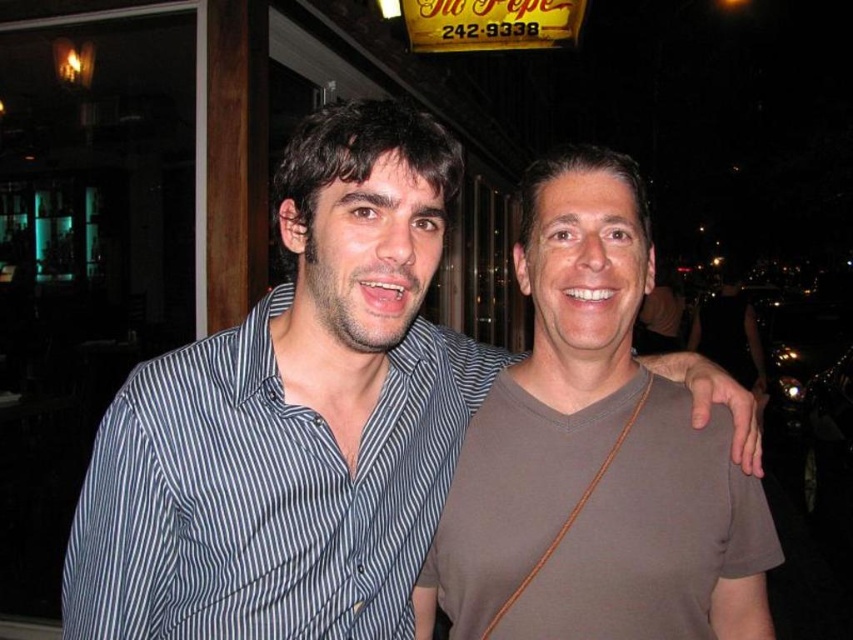
You are a photographer trying to capture the two friends standing outside the restaurant. You want to ensure that the striped cotton shirt at center is visible above the brown matte shirt at center in your photo. Is this possible based on their current positions?

Yes, the striped cotton shirt at center is already located above the brown matte shirt at center, so capturing this arrangement in the photo is feasible.

You are standing at the point marked with coordinates [384,189]. You want to move to the entrance of the building behind the illuminated sign. The entrance is 3 feet away from your current position. Can you reach the entrance without moving more than 3 feet?

The point marked with coordinates [384,189] and the viewer are 37.70 inches apart. Since 37.70 inches is approximately 3.14 feet, which is slightly more than 3 feet, you cannot reach the entrance without moving more than 3 feet.

You are a photographer trying to capture a clear shot of both the striped cotton shirt at center and the brown matte shirt at center. Since you want both shirts to be in focus, which one should you focus on first to ensure depth of field covers both?

You should focus on the striped cotton shirt at center first because it is closer to the viewer than the brown matte shirt at center, so adjusting the depth of field from the closer object will help both shirts be in focus.